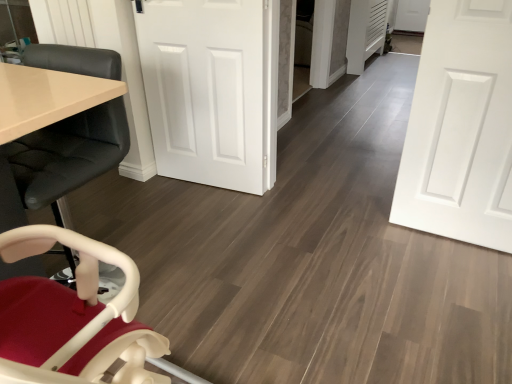
Identify the location of vacant space to the right of matte black chair at left. The image size is (512, 384). (193, 285).